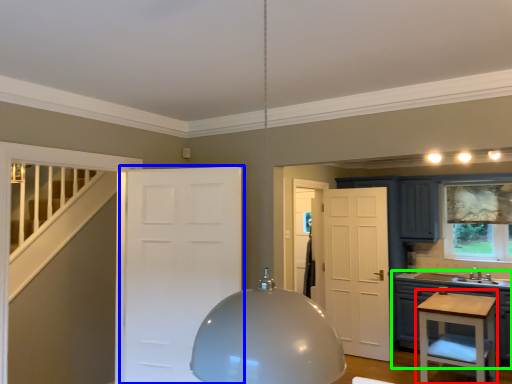
Question: Considering the real-world distances, which object is closest to vanity (highlighted by a red box)? door (highlighted by a blue box) or cabinetry (highlighted by a green box).

Choices:
 (A) door
 (B) cabinetry

Answer: (B)